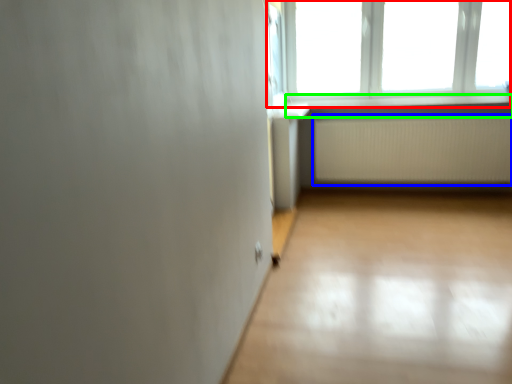
Question: Based on their relative distances, which object is farther from window (highlighted by a red box)? Choose from radiator (highlighted by a blue box) and window sill (highlighted by a green box).

Choices:
 (A) radiator
 (B) window sill

Answer: (A)